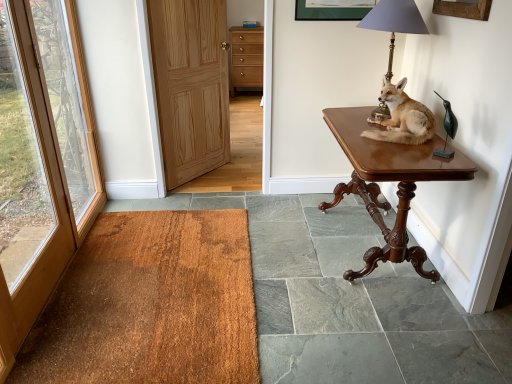
Locate an element on the screen. The height and width of the screenshot is (384, 512). vacant space in front of brown wood table at right is located at coordinates (380, 329).